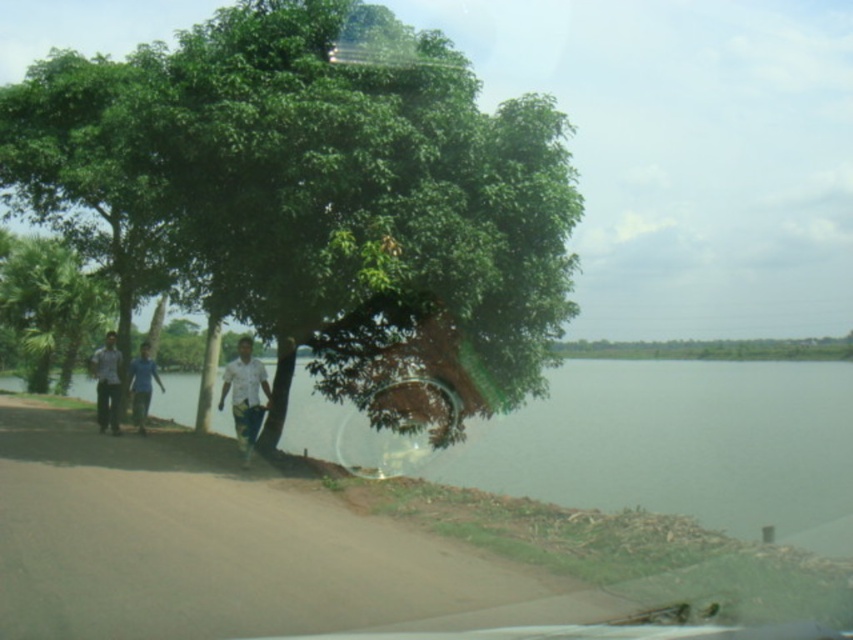
In the scene shown: Is green leafy tree at center behind light blue shirt at left?

No, green leafy tree at center is closer to the viewer.

Can you confirm if green leafy tree at center is thinner than light blue shirt at left?

No, green leafy tree at center is not thinner than light blue shirt at left.

Between point (167, 250) and point (100, 403), which one is positioned behind?

The point (100, 403) is behind.

Identify the location of green leafy tree at center. This screenshot has height=640, width=853. (318, 196).

Does green leafy tree at center have a lesser height compared to green water at lower left?

No, green leafy tree at center is not shorter than green water at lower left.

Which is more to the right, green leafy tree at center or green water at lower left?

green water at lower left

Image resolution: width=853 pixels, height=640 pixels. What do you see at coordinates (318, 196) in the screenshot?
I see `green leafy tree at center` at bounding box center [318, 196].

This screenshot has width=853, height=640. In order to click on green leafy tree at center in this screenshot , I will do `click(318, 196)`.

Is the position of green water at lower left more distant than that of blue cotton shirt at center?

No, it is not.

Between green water at lower left and blue cotton shirt at center, which one appears on the right side from the viewer's perspective?

Positioned to the right is green water at lower left.

Is point (560, 381) closer to camera compared to point (131, 376)?

No, (560, 381) is behind (131, 376).

Locate an element on the screen. green water at lower left is located at coordinates (680, 445).